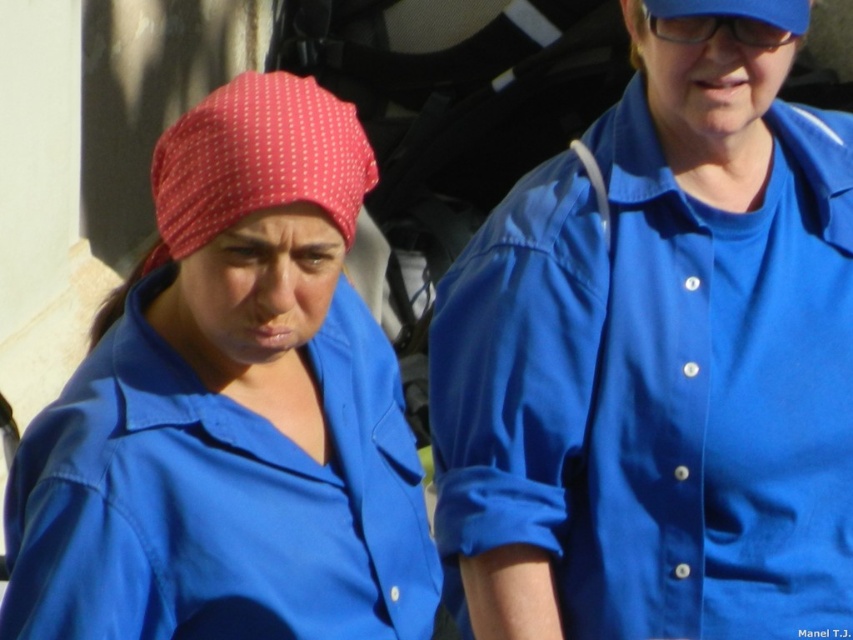
You are standing in a park and see two points marked in the image. The first point is at coordinate location point (573, 497) and the second point is at point (196, 138). Which point is closer to you?

Point (573, 497) is closer to you because it is further to the viewer than point (196, 138).

You are a photographer trying to capture a photo of the matte blue shirt at center. The camera is positioned at point A. The coordinates for the shirt are given as point B at 0.642, 0.272. If the camera can only focus on objects within a 0.2 radius from its position, is the shirt within the focus range?

The matte blue shirt at center is located at point B with coordinates (231, 410). To determine if it is within the camera focus range of 0.2 radius from point A, we need to calculate the distance between the two points. However, the exact coordinates of point A are not provided in the scene description. Without knowing point A, we cannot accurately assess the distance and thus cannot confirm if the shirt is within the focus range.

You are a photographer trying to capture a portrait of the person wearing the matte blue shirt at center and the red dotted fabric at left. To ensure both subjects are in focus, you need to know their vertical positions. Which one is positioned lower in the image?

The matte blue shirt at center is located below the red dotted fabric at left, so the matte blue shirt at center is lower in the image.